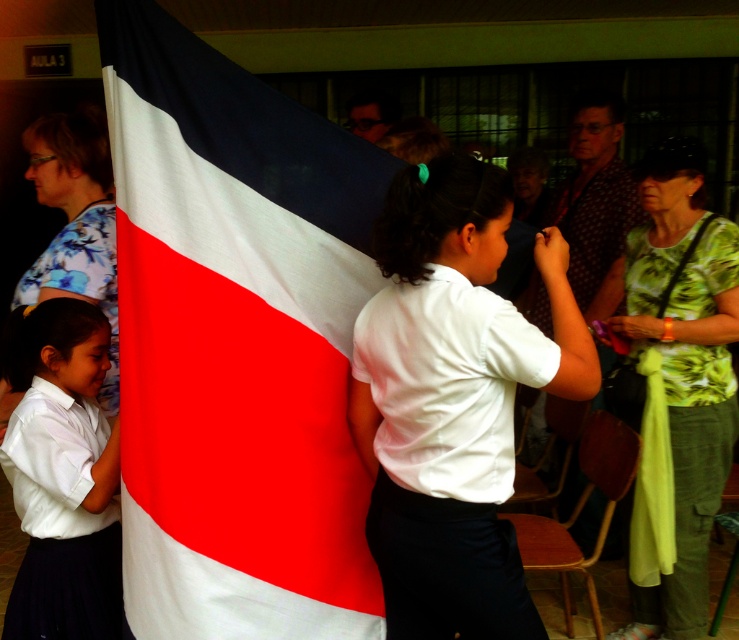
Is point (372, 378) positioned behind point (670, 157)?

That is False.

Does point (378, 508) lie in front of point (630, 636)?

That is True.

Identify the location of white smooth shirt at center. This screenshot has width=739, height=640. (452, 401).

I want to click on white smooth shirt at center, so click(452, 401).

Between point (593, 113) and point (33, 272), which one is positioned behind?

Point (593, 113)

Consider the image. Who is positioned more to the right, patterned fabric shirt at center or floral fabric blouse at left?

Positioned to the right is patterned fabric shirt at center.

Where is `patterned fabric shirt at center`? patterned fabric shirt at center is located at coordinates (595, 204).

I want to click on patterned fabric shirt at center, so click(x=595, y=204).

Is point (174, 621) positioned behind point (16, 596)?

No, it is in front of (16, 596).

Which is in front, point (126, 595) or point (75, 461)?

Point (75, 461) is more forward.

Where is `textured fabric flag at center`? Image resolution: width=739 pixels, height=640 pixels. textured fabric flag at center is located at coordinates (236, 342).